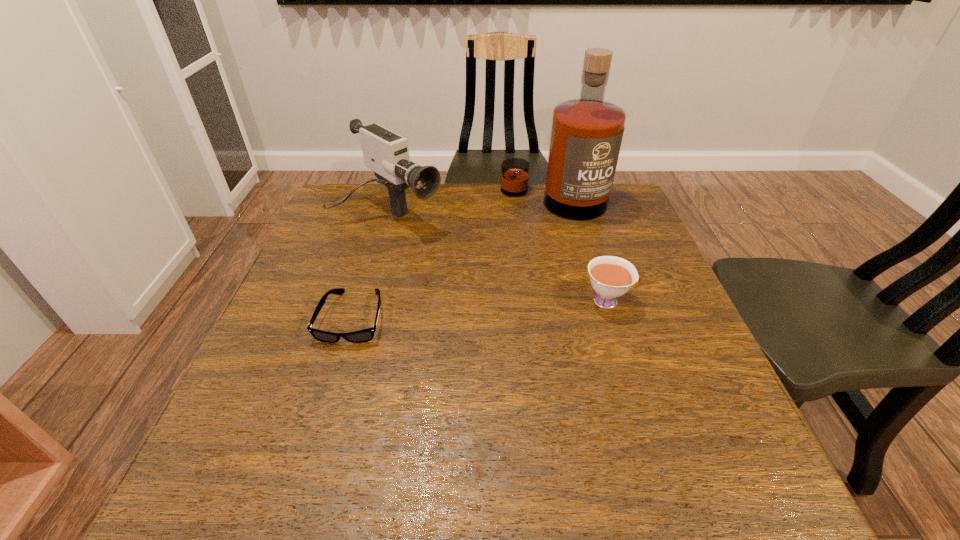
Locate an element on the screen. the shortest object is located at coordinates (365, 335).

You are a GUI agent. You are given a task and a screenshot of the screen. Output one action in this format:
    pyautogui.click(x=<x>, y=<y>)
    Task: Click on the third tallest object
    The width and height of the screenshot is (960, 540).
    Given the screenshot: What is the action you would take?
    pyautogui.click(x=611, y=277)

Where is `camcorder`? The height and width of the screenshot is (540, 960). camcorder is located at coordinates (386, 153).

This screenshot has width=960, height=540. Identify the location of liquor. (586, 134).

Identify the location of vacant point located 0.170m on the front-facing side of the shortest object. tap(321, 424).

The height and width of the screenshot is (540, 960). Identify the location of free space located 0.100m on the side of the teacup with the handle. (680, 301).

I want to click on vacant region located on the recording direction of the third shortest object, so click(519, 298).

Identify the location of blank space located on the recording direction of the third shortest object. This screenshot has height=540, width=960. (537, 309).

Where is `vacant area situated 0.200m on the recording direction of the third shortest object`? vacant area situated 0.200m on the recording direction of the third shortest object is located at coordinates (477, 269).

Locate an element on the screen. This screenshot has height=540, width=960. vacant space situated on the front label of the tallest object is located at coordinates (508, 311).